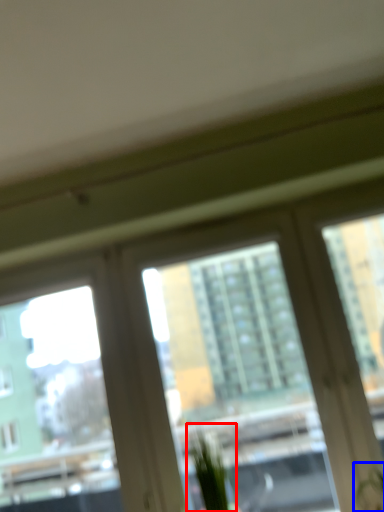
Question: Among these objects, which one is farthest to the camera, plant (highlighted by a red box) or plant (highlighted by a blue box)?

Choices:
 (A) plant
 (B) plant

Answer: (A)